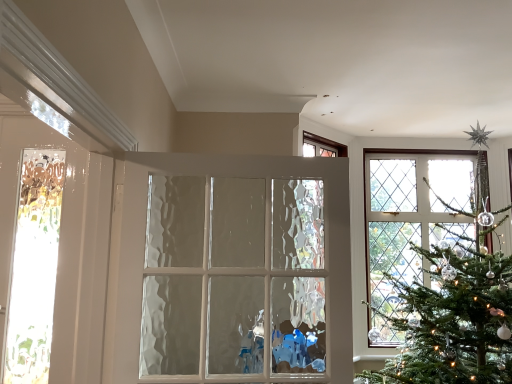
What do you see at coordinates (65, 244) in the screenshot? I see `translucent glass door at left, which appears as the first door when viewed from the left` at bounding box center [65, 244].

You are a GUI agent. You are given a task and a screenshot of the screen. Output one action in this format:
    pyautogui.click(x=<x>, y=<y>)
    Task: Click on the translucent glass door at left, which appears as the first door when viewed from the left
    The width and height of the screenshot is (512, 384).
    Given the screenshot: What is the action you would take?
    pyautogui.click(x=65, y=244)

Measure the distance between translucent glass door at left, the second door when ordered from right to left, and camera.

1.43 meters.

Where is `white textured glass door at center, which ranks as the 2th door in left-to-right order`? white textured glass door at center, which ranks as the 2th door in left-to-right order is located at coordinates (241, 268).

Image resolution: width=512 pixels, height=384 pixels. Describe the element at coordinates (241, 268) in the screenshot. I see `white textured glass door at center, which ranks as the 2th door in left-to-right order` at that location.

Measure the distance between point (348, 370) and camera.

Answer: 1.48 meters.

What is the approximate height of white textured glass door at center, the first door when ordered from right to left?

The height of white textured glass door at center, the first door when ordered from right to left, is 33.42 inches.

Identify the location of translucent glass door at left, the second door when ordered from right to left. (65, 244).

Does white textured glass door at center, which ranks as the 2th door in left-to-right order, appear on the left side of translucent glass door at left, the second door when ordered from right to left?

No.

Which object is closer to the camera, white textured glass door at center, the first door when ordered from right to left, or translucent glass door at left, which appears as the first door when viewed from the left?

white textured glass door at center, the first door when ordered from right to left, is more forward.

Does point (142, 204) come in front of point (100, 355)?

No, (142, 204) is further to viewer.

From the image's perspective, which one is positioned higher, white textured glass door at center, the first door when ordered from right to left, or translucent glass door at left, which appears as the first door when viewed from the left?

translucent glass door at left, which appears as the first door when viewed from the left, appears higher in the image.

From the picture: From a real-world perspective, who is located lower, white textured glass door at center, which ranks as the 2th door in left-to-right order, or translucent glass door at left, the second door when ordered from right to left?

white textured glass door at center, which ranks as the 2th door in left-to-right order, from a real-world perspective.

Considering the sizes of objects white textured glass door at center, the first door when ordered from right to left, and translucent glass door at left, which appears as the first door when viewed from the left, in the image provided, who is thinner, white textured glass door at center, the first door when ordered from right to left, or translucent glass door at left, which appears as the first door when viewed from the left,?

With smaller width is translucent glass door at left, which appears as the first door when viewed from the left.

Is white textured glass door at center, which ranks as the 2th door in left-to-right order, taller or shorter than translucent glass door at left, which appears as the first door when viewed from the left?

white textured glass door at center, which ranks as the 2th door in left-to-right order, is shorter than translucent glass door at left, which appears as the first door when viewed from the left.

Who is smaller, white textured glass door at center, which ranks as the 2th door in left-to-right order, or translucent glass door at left, the second door when ordered from right to left?

translucent glass door at left, the second door when ordered from right to left.

Is translucent glass door at left, which appears as the first door when viewed from the left, completely or partially inside white textured glass door at center, which ranks as the 2th door in left-to-right order?

No, translucent glass door at left, which appears as the first door when viewed from the left, is not inside white textured glass door at center, which ranks as the 2th door in left-to-right order.

Does white textured glass door at center, which ranks as the 2th door in left-to-right order, touch translucent glass door at left, which appears as the first door when viewed from the left?

white textured glass door at center, which ranks as the 2th door in left-to-right order, and translucent glass door at left, which appears as the first door when viewed from the left, are clearly separated.

Could you tell me if white textured glass door at center, which ranks as the 2th door in left-to-right order, is facing translucent glass door at left, which appears as the first door when viewed from the left?

No, white textured glass door at center, which ranks as the 2th door in left-to-right order, does not turn towards translucent glass door at left, which appears as the first door when viewed from the left.

How many degrees apart are the facing directions of white textured glass door at center, the first door when ordered from right to left, and translucent glass door at left, which appears as the first door when viewed from the left?

They differ by 12.5 degrees in their facing directions.

You are a GUI agent. You are given a task and a screenshot of the screen. Output one action in this format:
    pyautogui.click(x=<x>, y=<y>)
    Task: Click on the door below the translucent glass door at left, which appears as the first door when viewed from the left (from a real-world perspective)
    This screenshot has width=512, height=384.
    Given the screenshot: What is the action you would take?
    pyautogui.click(x=241, y=268)

Is translucent glass door at left, the second door when ordered from right to left, to the left of white textured glass door at center, which ranks as the 2th door in left-to-right order, from the viewer's perspective?

Indeed, translucent glass door at left, the second door when ordered from right to left, is positioned on the left side of white textured glass door at center, which ranks as the 2th door in left-to-right order.

Considering the positions of objects translucent glass door at left, which appears as the first door when viewed from the left, and white textured glass door at center, the first door when ordered from right to left, in the image provided, who is in front, translucent glass door at left, which appears as the first door when viewed from the left, or white textured glass door at center, the first door when ordered from right to left,?

white textured glass door at center, the first door when ordered from right to left, is in front.

Is point (1, 326) farther from camera compared to point (139, 379)?

Yes, point (1, 326) is behind point (139, 379).

From the image's perspective, is translucent glass door at left, the second door when ordered from right to left, located above or below white textured glass door at center, which ranks as the 2th door in left-to-right order?

translucent glass door at left, the second door when ordered from right to left, is above white textured glass door at center, which ranks as the 2th door in left-to-right order.

From a real-world perspective, relative to white textured glass door at center, the first door when ordered from right to left, is translucent glass door at left, which appears as the first door when viewed from the left, vertically above or below?

translucent glass door at left, which appears as the first door when viewed from the left, is above white textured glass door at center, the first door when ordered from right to left.

Considering the sizes of objects translucent glass door at left, which appears as the first door when viewed from the left, and white textured glass door at center, which ranks as the 2th door in left-to-right order, in the image provided, who is thinner, translucent glass door at left, which appears as the first door when viewed from the left, or white textured glass door at center, which ranks as the 2th door in left-to-right order,?

translucent glass door at left, which appears as the first door when viewed from the left, is thinner.

Does translucent glass door at left, which appears as the first door when viewed from the left, have a lesser height compared to white textured glass door at center, the first door when ordered from right to left?

No.

Is translucent glass door at left, the second door when ordered from right to left, bigger or smaller than white textured glass door at center, the first door when ordered from right to left?

Clearly, translucent glass door at left, the second door when ordered from right to left, is smaller in size than white textured glass door at center, the first door when ordered from right to left.

Which is correct: translucent glass door at left, which appears as the first door when viewed from the left, is inside white textured glass door at center, the first door when ordered from right to left, or outside of it?

translucent glass door at left, which appears as the first door when viewed from the left, lies outside white textured glass door at center, the first door when ordered from right to left.

Are translucent glass door at left, which appears as the first door when viewed from the left, and white textured glass door at center, which ranks as the 2th door in left-to-right order, making contact?

translucent glass door at left, which appears as the first door when viewed from the left, is not next to white textured glass door at center, which ranks as the 2th door in left-to-right order, and they're not touching.

Is white textured glass door at center, the first door when ordered from right to left, at the back of translucent glass door at left, which appears as the first door when viewed from the left?

No, white textured glass door at center, the first door when ordered from right to left, is not at the back of translucent glass door at left, which appears as the first door when viewed from the left.

What's the angular difference between translucent glass door at left, the second door when ordered from right to left, and white textured glass door at center, which ranks as the 2th door in left-to-right order,'s facing directions?

The angle between the facing direction of translucent glass door at left, the second door when ordered from right to left, and the facing direction of white textured glass door at center, which ranks as the 2th door in left-to-right order, is 12.5 degrees.

How distant is translucent glass door at left, which appears as the first door when viewed from the left, from white textured glass door at center, which ranks as the 2th door in left-to-right order?

translucent glass door at left, which appears as the first door when viewed from the left, and white textured glass door at center, which ranks as the 2th door in left-to-right order, are 33.02 inches apart.

At what (x,y) coordinates should I click in order to perform the action: click on door in front of the translucent glass door at left, which appears as the first door when viewed from the left. Please return your answer as a coordinate pair (x, y). Looking at the image, I should click on (241, 268).

I want to click on door lying below the translucent glass door at left, the second door when ordered from right to left (from the image's perspective), so click(x=241, y=268).

I want to click on door in front of the translucent glass door at left, the second door when ordered from right to left, so click(241, 268).